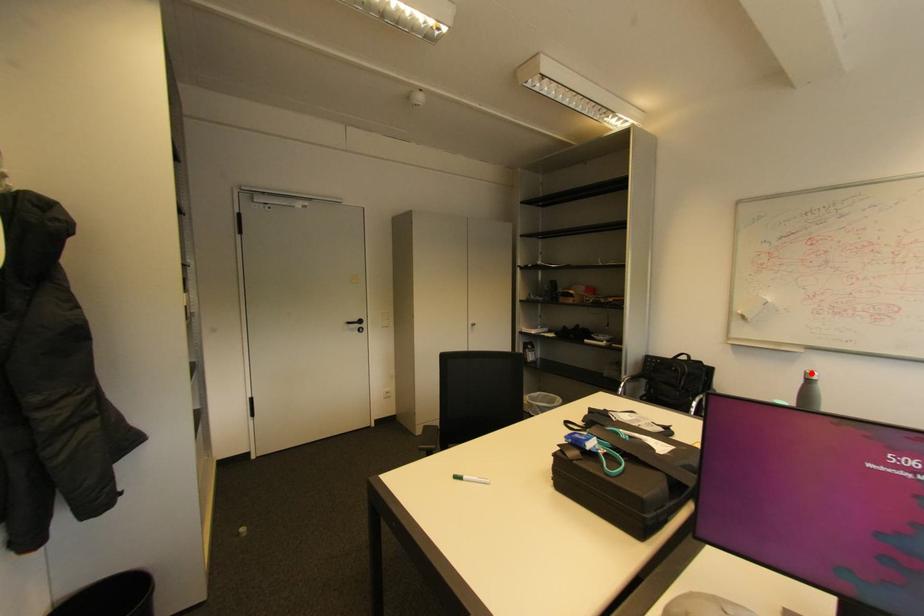
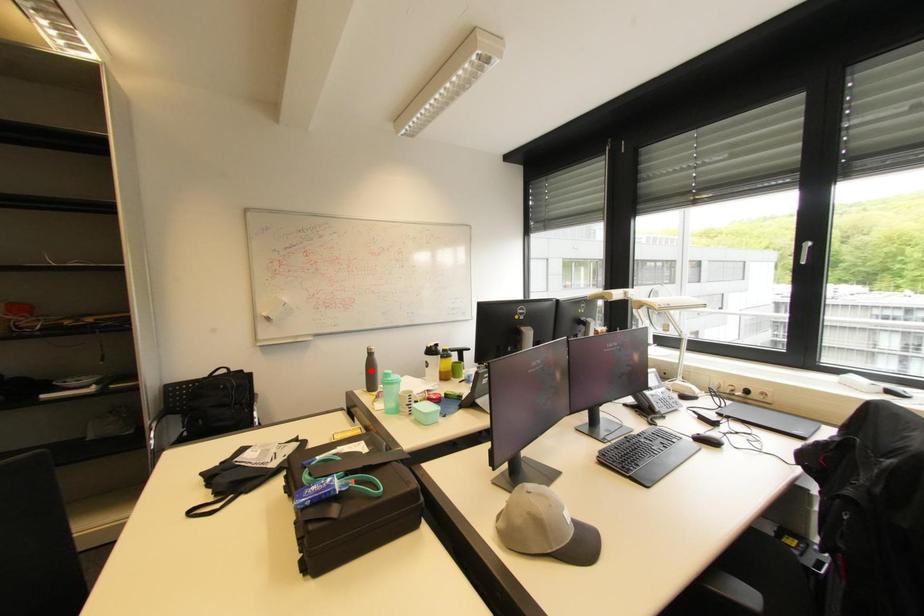
I am providing you with two images of the same scene from different viewpoints. A red point is marked on the first image and another point is marked on the second image. Does the point marked in image1 correspond to the same location as the one in image2?

No